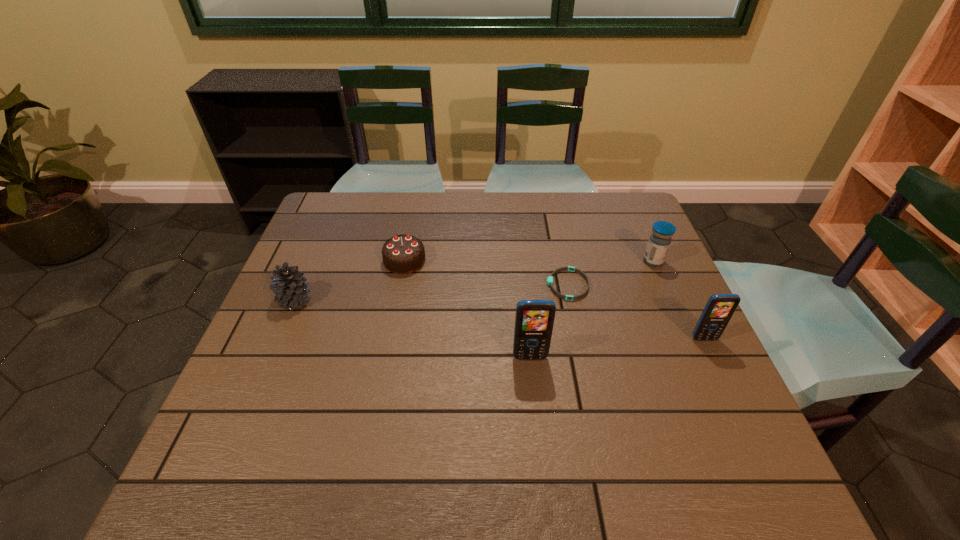
Where is `the nearest object`? Image resolution: width=960 pixels, height=540 pixels. the nearest object is located at coordinates (534, 319).

Locate an element on the screen. This screenshot has width=960, height=540. the fourth object from right to left is located at coordinates (534, 319).

Find the location of `the shorter cellular telephone`. the shorter cellular telephone is located at coordinates (719, 309).

What are the coordinates of `the right cellular telephone` in the screenshot? It's located at (719, 309).

Where is `the fifth tallest object`? This screenshot has height=540, width=960. the fifth tallest object is located at coordinates (402, 254).

Where is `the fifth object from right to left`? The height and width of the screenshot is (540, 960). the fifth object from right to left is located at coordinates (402, 254).

Where is `medicine`? This screenshot has height=540, width=960. medicine is located at coordinates (660, 239).

The height and width of the screenshot is (540, 960). In order to click on the shortest object in this screenshot , I will do `click(550, 279)`.

Identify the location of the fourth object from left to right. (550, 279).

The image size is (960, 540). I want to click on pinecone, so click(x=288, y=284).